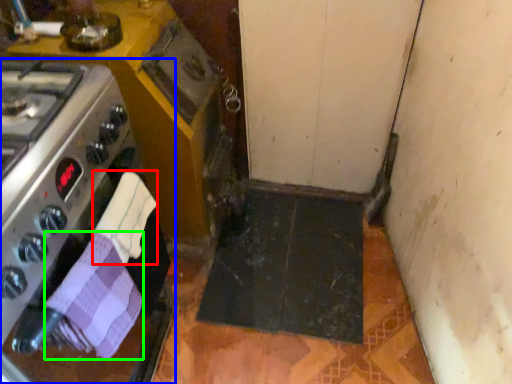
Question: Considering the real-world distances, which object is closest to hand towel (highlighted by a red box)? kitchen appliance (highlighted by a blue box) or hand towel (highlighted by a green box).

Choices:
 (A) kitchen appliance
 (B) hand towel

Answer: (B)